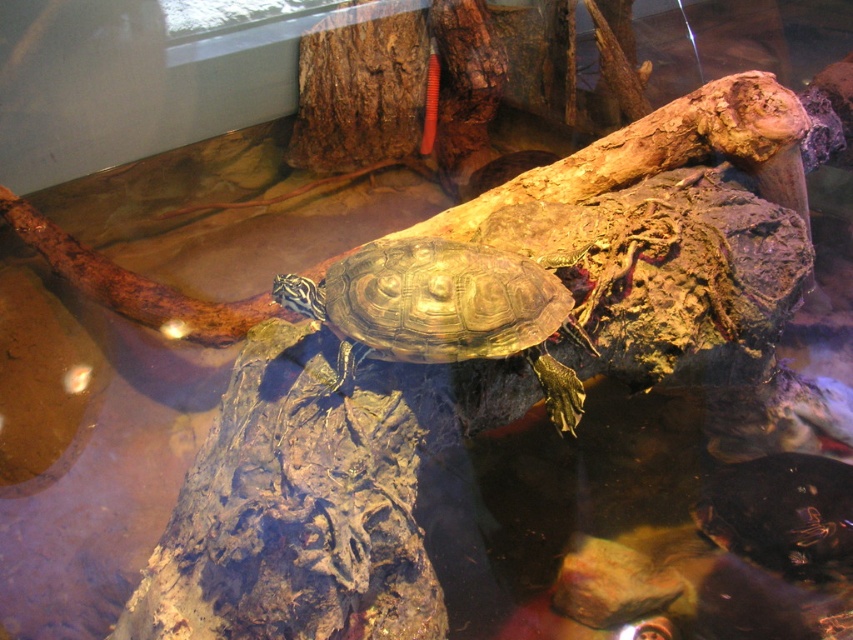
Is shiny brown tortoise at center thinner than shiny dark green tortoise at center?

In fact, shiny brown tortoise at center might be wider than shiny dark green tortoise at center.

Who is more distant from viewer, (x=538, y=284) or (x=780, y=484)?

The point (x=780, y=484) is more distant.

Which is behind, point (332, 289) or point (759, 474)?

The point (759, 474) is more distant.

Image resolution: width=853 pixels, height=640 pixels. I want to click on shiny brown tortoise at center, so click(x=445, y=310).